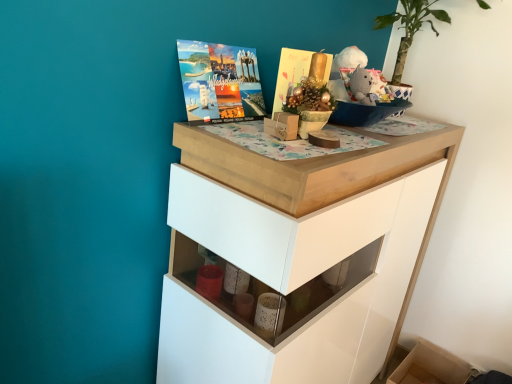
Question: Is matte brown box at center with matte gold magazine at upper center?

Choices:
 (A) no
 (B) yes

Answer: (A)

Question: Is matte brown box at center oriented away from matte gold magazine at upper center?

Choices:
 (A) no
 (B) yes

Answer: (A)

Question: Is matte brown box at center closer to the viewer compared to matte gold magazine at upper center?

Choices:
 (A) no
 (B) yes

Answer: (B)

Question: Is matte brown box at center to the left of matte gold magazine at upper center from the viewer's perspective?

Choices:
 (A) yes
 (B) no

Answer: (A)

Question: From the image's perspective, is matte brown box at center located beneath matte gold magazine at upper center?

Choices:
 (A) no
 (B) yes

Answer: (B)

Question: Is the position of matte brown box at center more distant than that of matte gold magazine at upper center?

Choices:
 (A) no
 (B) yes

Answer: (A)

Question: From the image's perspective, is matte gold magazine at upper center located beneath matte brown box at center?

Choices:
 (A) no
 (B) yes

Answer: (A)

Question: Is matte gold magazine at upper center taller than matte brown box at center?

Choices:
 (A) no
 (B) yes

Answer: (B)

Question: Is matte gold magazine at upper center outside of matte brown box at center?

Choices:
 (A) yes
 (B) no

Answer: (A)

Question: From a real-world perspective, does matte gold magazine at upper center stand above matte brown box at center?

Choices:
 (A) yes
 (B) no

Answer: (A)

Question: Can you confirm if matte gold magazine at upper center is shorter than matte brown box at center?

Choices:
 (A) no
 (B) yes

Answer: (A)

Question: Is matte gold magazine at upper center to the left of matte brown box at center from the viewer's perspective?

Choices:
 (A) no
 (B) yes

Answer: (A)

Question: From a real-world perspective, is matte brown box at center on knitted gray bear at upper right?

Choices:
 (A) yes
 (B) no

Answer: (B)